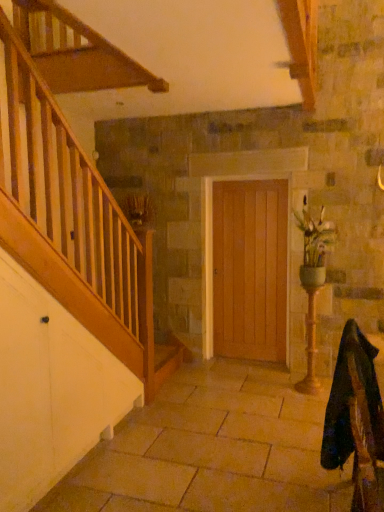
Question: Is green ceramic vase at right wider or thinner than velvet dark green rocking chair at lower right?

Choices:
 (A) thin
 (B) wide

Answer: (A)

Question: In terms of size, does green ceramic vase at right appear bigger or smaller than velvet dark green rocking chair at lower right?

Choices:
 (A) big
 (B) small

Answer: (B)

Question: Estimate the real-world distances between objects in this image. Which object is closer to the velvet dark green rocking chair at lower right?

Choices:
 (A) wooden door at center
 (B) brown textured plant at upper left
 (C) green ceramic vase at right

Answer: (C)

Question: Estimate the real-world distances between objects in this image. Which object is closer to the velvet dark green rocking chair at lower right?

Choices:
 (A) wooden door at center
 (B) brown textured plant at upper left
 (C) green ceramic vase at right

Answer: (C)